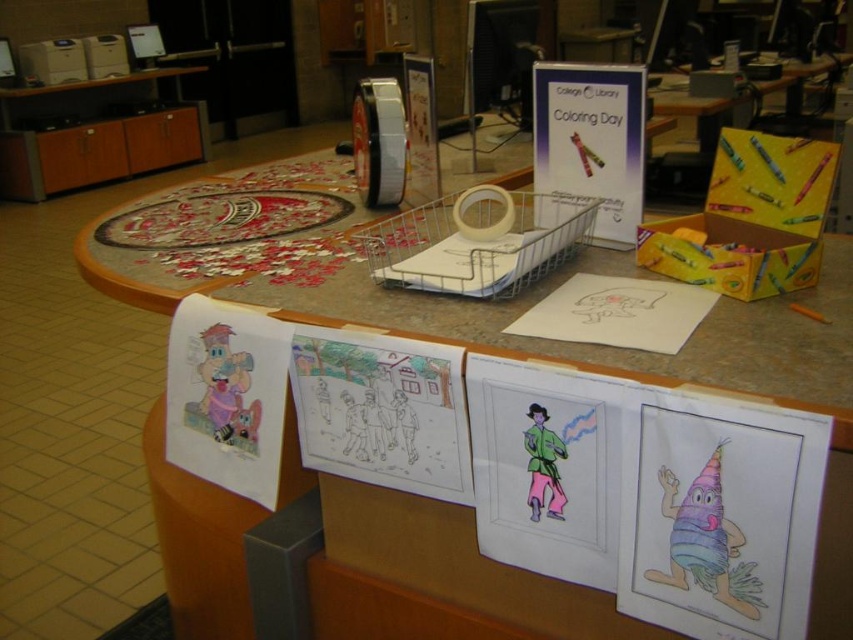
You are standing at the origin point in the image. Which of the two points, point (303,237) or point (820,317), is closer to you?

Point (820,317) is closer to you because it is in front of point (303,237).